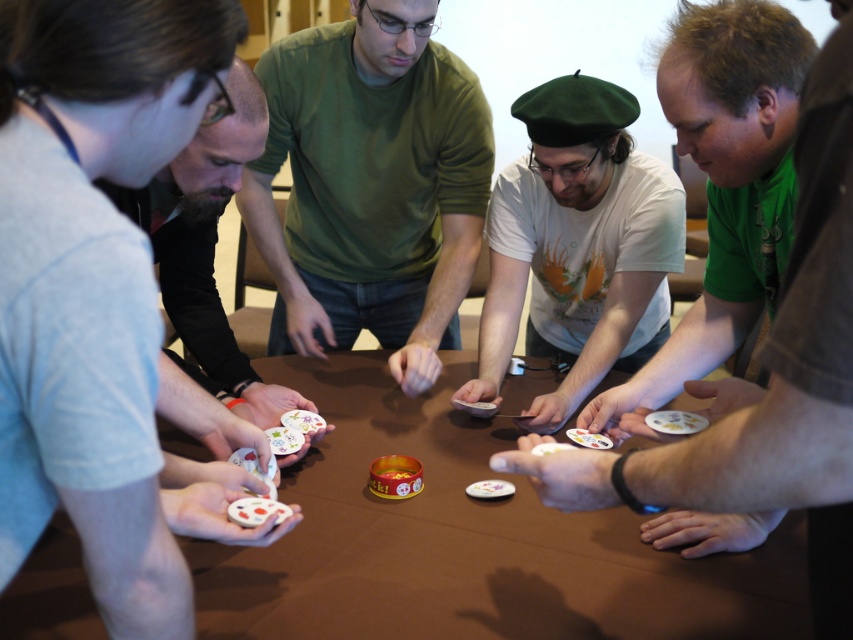
Can you confirm if white matte beret at center is positioned above smooth gray shirt at left?

No, white matte beret at center is not above smooth gray shirt at left.

Which is above, white matte beret at center or smooth gray shirt at left?

smooth gray shirt at left is above.

Does point (558, 154) come farther from viewer compared to point (248, 72)?

Yes, point (558, 154) is farther from viewer.

Find the location of `white matte beret at center`. white matte beret at center is located at coordinates (577, 244).

Which is below, green matte shirt at center or smooth gray shirt at left?

smooth gray shirt at left is below.

Based on the photo, is green matte shirt at center taller than smooth gray shirt at left?

Yes.

Is point (328, 344) farther from camera compared to point (169, 230)?

Yes, it is.

The image size is (853, 640). Identify the location of green matte shirt at center. (372, 182).

Which is in front, point (439, 385) or point (399, 20)?

Point (399, 20)

Can you confirm if brown matte table at center is positioned above green matte shirt at center?

Actually, brown matte table at center is below green matte shirt at center.

This screenshot has height=640, width=853. Find the location of `brown matte table at center`. brown matte table at center is located at coordinates click(467, 541).